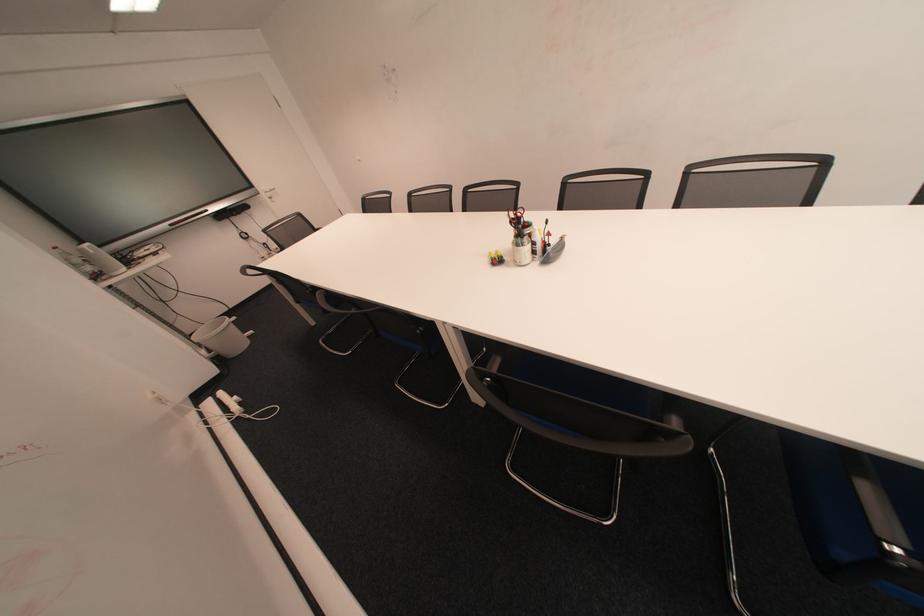
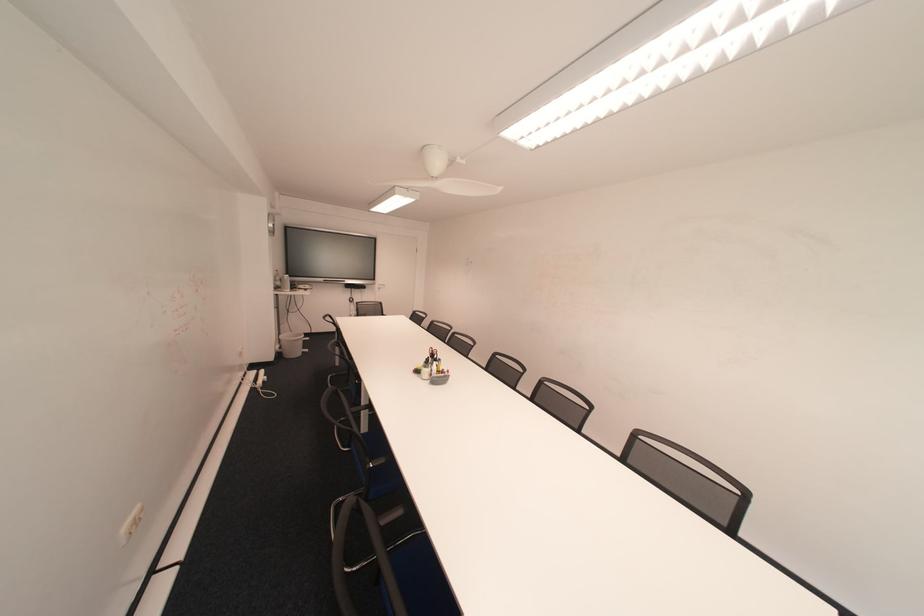
Find the pixel in the second image that matches the point at 229,360 in the first image.

(290, 355)